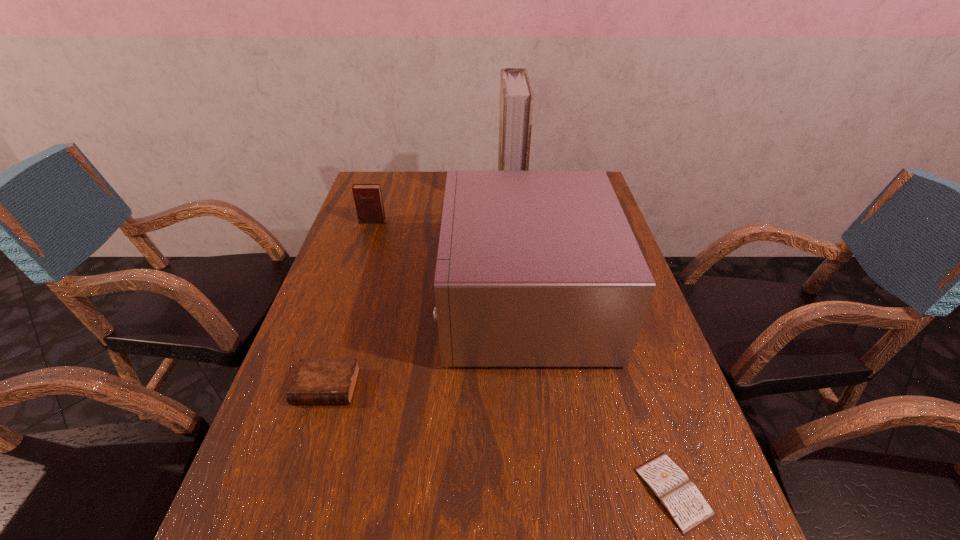
Where is `vacant space located 0.260m on the cover of the tallest object`? The height and width of the screenshot is (540, 960). vacant space located 0.260m on the cover of the tallest object is located at coordinates (425, 194).

I want to click on vacant region located 0.360m on the cover of the tallest object, so click(396, 194).

Identify the location of free space located 0.120m with the door open on the microwave oven. (397, 300).

This screenshot has width=960, height=540. I want to click on free space located with the door open on the microwave oven, so click(371, 300).

Find the location of a particular element. vacant space situated with the door open on the microwave oven is located at coordinates (382, 300).

Find the location of a particular element. Image resolution: width=960 pixels, height=540 pixels. free space located on the front cover of the third tallest object is located at coordinates (358, 263).

Identify the location of vacant space positioned on the spine side of the second farthest diary. (313, 429).

Image resolution: width=960 pixels, height=540 pixels. I want to click on vacant point located on the left of the rightmost diary, so click(x=600, y=491).

At what (x,y) coordinates should I click in order to perform the action: click on object that is at the far edge. Please return your answer as a coordinate pair (x, y). The image size is (960, 540). Looking at the image, I should click on (516, 96).

Identify the location of microwave oven present at the right edge. [x=536, y=268].